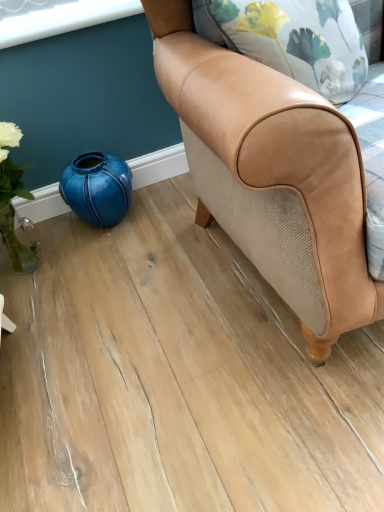
In order to click on vacant space in front of teal glossy vase at lower left in this screenshot , I will do `click(127, 254)`.